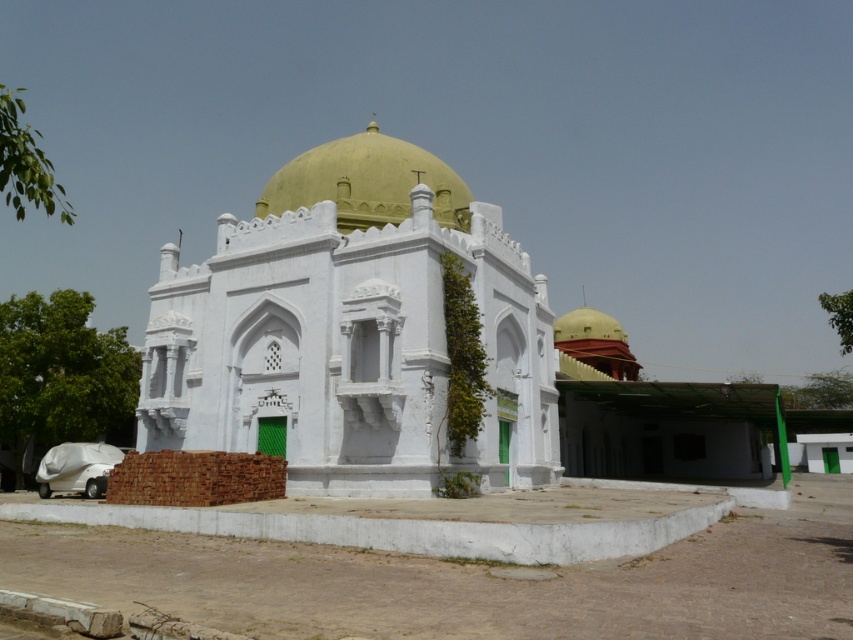
Question: Is white stone dome at center smaller than golden polished dome at center?

Choices:
 (A) yes
 (B) no

Answer: (A)

Question: Which point appears closest to the camera in this image?

Choices:
 (A) (549, 362)
 (B) (340, 195)

Answer: (B)

Question: Where is white stone dome at center located in relation to golden polished dome at center in the image?

Choices:
 (A) below
 (B) above

Answer: (A)

Question: Does white stone dome at center appear on the right side of golden polished dome at center?

Choices:
 (A) no
 (B) yes

Answer: (B)

Question: Among these points, which one is nearest to the camera?

Choices:
 (A) (274, 193)
 (B) (263, 300)

Answer: (B)